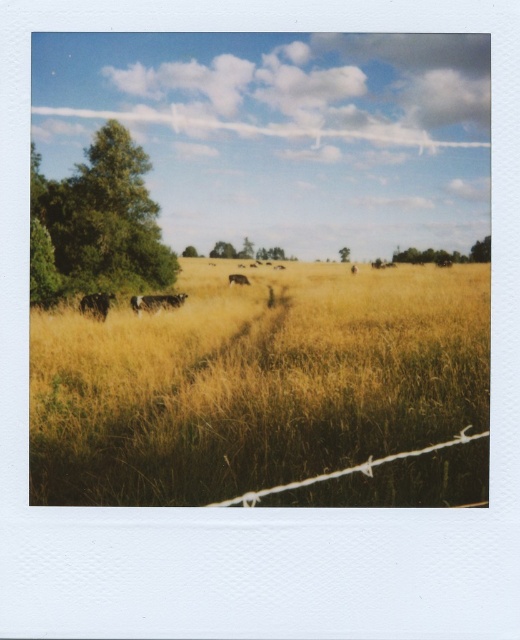
Question: Can you confirm if green leafy tree at left is wider than green leafy tree at upper left?

Choices:
 (A) no
 (B) yes

Answer: (B)

Question: Is yellow grassy field at lower left to the left of black speckled cow at left from the viewer's perspective?

Choices:
 (A) no
 (B) yes

Answer: (A)

Question: Does green leafy tree at left have a lesser width compared to silver wire fence at lower center?

Choices:
 (A) yes
 (B) no

Answer: (B)

Question: Which object is farther from the camera taking this photo?

Choices:
 (A) green leafy tree at left
 (B) brown furry cow at center
 (C) green leafy tree at upper right

Answer: (C)

Question: Which is nearer to the black speckled cow at left?

Choices:
 (A) brown furry cow at center
 (B) green leafy tree at upper right

Answer: (A)

Question: Which of the following is the farthest from the observer?

Choices:
 (A) (230, 280)
 (B) (474, 436)
 (C) (341, 256)

Answer: (C)